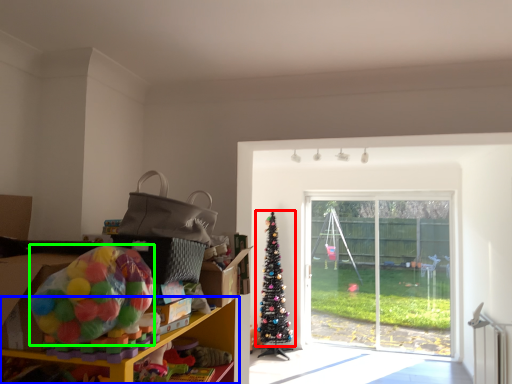
Question: Based on their relative distances, which object is farther from christmas tree (highlighted by a red box)? Choose from shelf (highlighted by a blue box) and toy (highlighted by a green box).

Choices:
 (A) shelf
 (B) toy

Answer: (B)